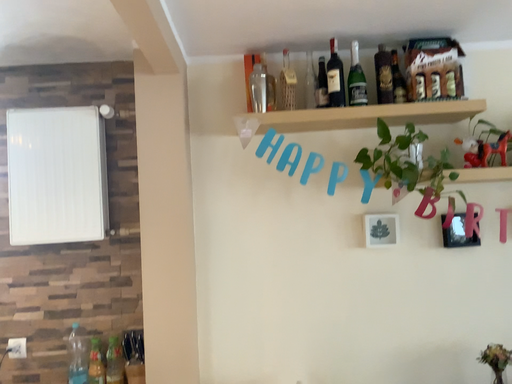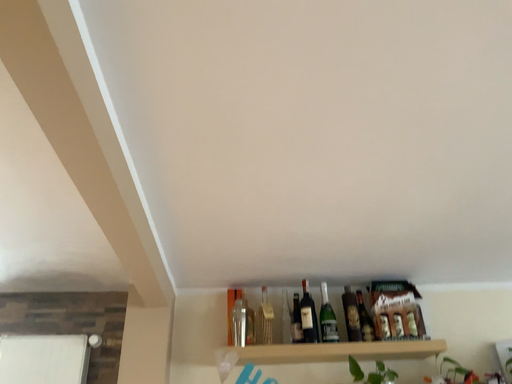
Question: Which way did the camera rotate in the video?

Choices:
 (A) rotated downward
 (B) rotated upward

Answer: (B)